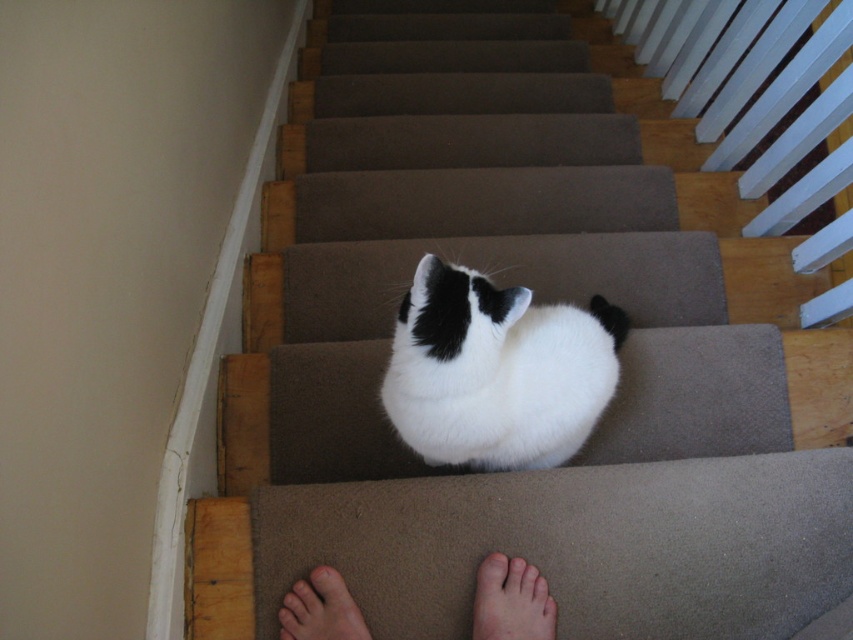
Question: Which point appears closest to the camera in this image?

Choices:
 (A) (506, 412)
 (B) (354, 627)
 (C) (473, 621)

Answer: (A)

Question: Observing the image, what is the correct spatial positioning of pale skin at lower center in reference to light brown skin at lower center?

Choices:
 (A) left
 (B) right

Answer: (B)

Question: Is white fluffy cat at center to the right of pale skin at lower center from the viewer's perspective?

Choices:
 (A) no
 (B) yes

Answer: (A)

Question: Is white fluffy cat at center thinner than pale skin at lower center?

Choices:
 (A) yes
 (B) no

Answer: (B)

Question: Considering the real-world distances, which object is closest to the white fluffy cat at center?

Choices:
 (A) pale skin at lower center
 (B) light brown skin at lower center

Answer: (A)

Question: Among these points, which one is nearest to the camera?

Choices:
 (A) (496, 428)
 (B) (527, 612)
 (C) (306, 588)

Answer: (A)